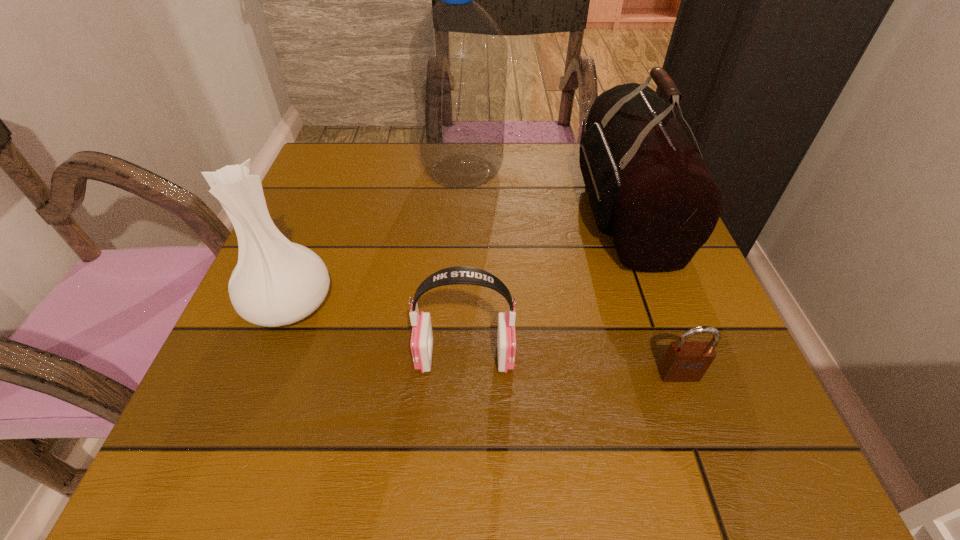
At what (x,y) coordinates should I click in order to perform the action: click on free point between the second shortest object and the padlock. Please return your answer as a coordinate pair (x, y). Looking at the image, I should click on (572, 366).

Where is `free area in between the shortest object and the earphone`? The width and height of the screenshot is (960, 540). free area in between the shortest object and the earphone is located at coordinates (572, 366).

Where is `unoccupied position between the tallest object and the earphone`? The image size is (960, 540). unoccupied position between the tallest object and the earphone is located at coordinates (464, 264).

I want to click on vacant point located between the tallest object and the duffel bag, so click(x=543, y=191).

Identify which object is the third nearest to the padlock. Please provide its 2D coordinates. Your answer should be formatted as a tuple, i.e. [(x, y)], where the tuple contains the x and y coordinates of a point satisfying the conditions above.

[(458, 54)]

Identify the location of object that stands as the closest to the second shortest object. This screenshot has height=540, width=960. (276, 282).

Find the location of a particular element. Image resolution: width=960 pixels, height=540 pixels. free location that satisfies the following two spatial constraints: 1. on the back side of the water jug; 2. on the left side of the vase is located at coordinates (343, 171).

Locate an element on the screen. vacant area in the image that satisfies the following two spatial constraints: 1. on the back side of the water jug; 2. on the right side of the leftmost object is located at coordinates (343, 171).